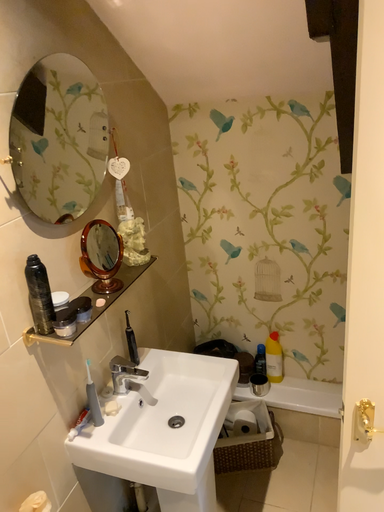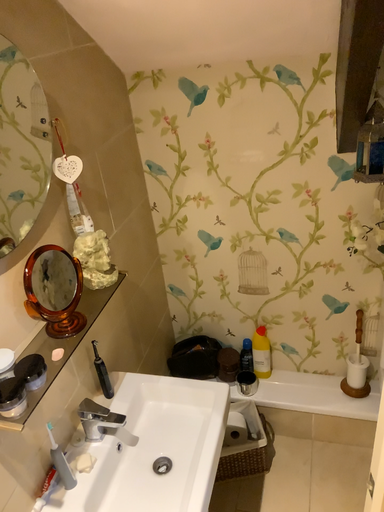
Question: Which way did the camera rotate in the video?

Choices:
 (A) rotated downward
 (B) rotated upward

Answer: (A)